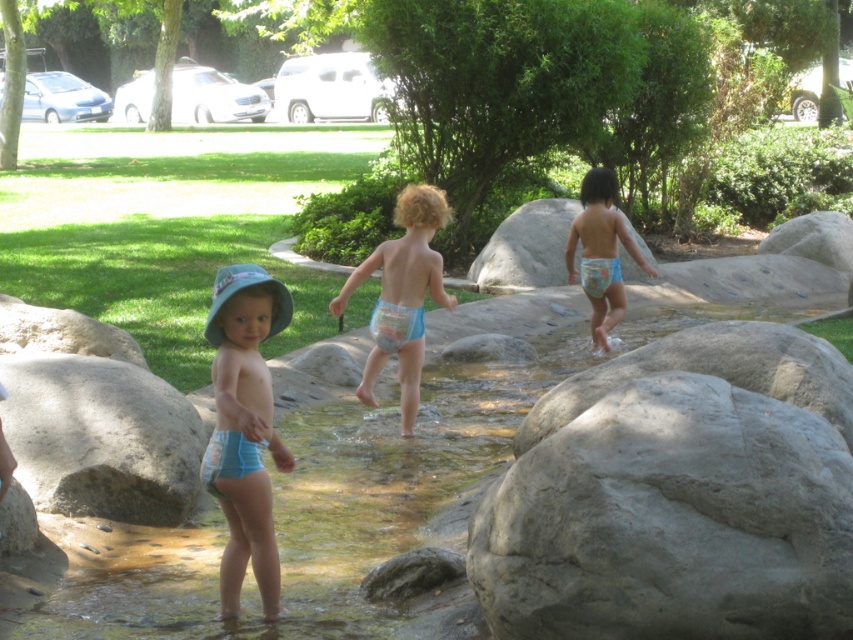
Question: Which point is farther from the camera taking this photo?

Choices:
 (A) (45, 396)
 (B) (712, 529)

Answer: (A)

Question: From the image, what is the correct spatial relationship of blue cloth diaper at center in relation to blue fabric diaper at center?

Choices:
 (A) right
 (B) left

Answer: (B)

Question: Does gray rough rock at lower right appear over gray rough boulder at lower left?

Choices:
 (A) yes
 (B) no

Answer: (B)

Question: Does gray stone boulder at center appear over blue fabric diaper at center?

Choices:
 (A) no
 (B) yes

Answer: (B)

Question: Among these objects, which one is farthest from the camera?

Choices:
 (A) blue fabric diaper at center
 (B) gray stone boulder at center
 (C) gray rough rock at lower right
 (D) blue cloth diaper at center

Answer: (B)

Question: Which of the following is the farthest from the observer?

Choices:
 (A) (544, 260)
 (B) (126, 493)
 (C) (440, 202)

Answer: (A)